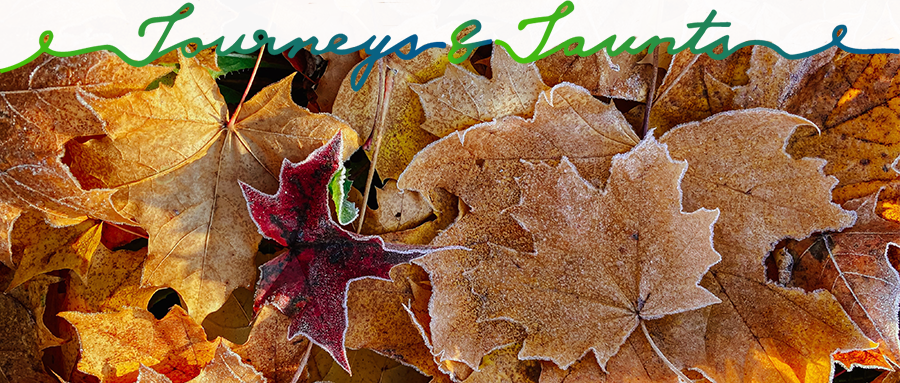
Find the location of `picture`. picture is located at coordinates (500, 35).